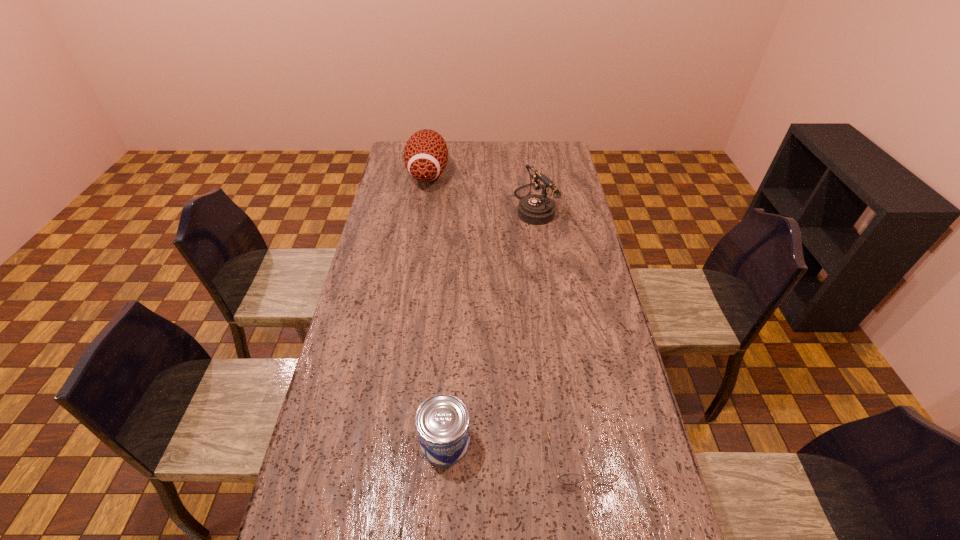
At what (x,y) coordinates should I click in order to perform the action: click on free spot between the shortest object and the football. Please return your answer as a coordinate pair (x, y). Looking at the image, I should click on 505,315.

Image resolution: width=960 pixels, height=540 pixels. I want to click on vacant space that is in between the telephone and the spectacles, so click(558, 330).

Locate an element on the screen. The width and height of the screenshot is (960, 540). blank region between the telephone and the third tallest object is located at coordinates (490, 322).

Where is `the third closest object to the football`? The height and width of the screenshot is (540, 960). the third closest object to the football is located at coordinates (567, 478).

At what (x,y) coordinates should I click in order to perform the action: click on object that is the closest to the telephone. Please return your answer as a coordinate pair (x, y). The height and width of the screenshot is (540, 960). Looking at the image, I should click on (426, 154).

In order to click on free region that satisfies the following two spatial constraints: 1. on the front side of the tallest object; 2. on the right side of the telephone in this screenshot , I will do `click(423, 204)`.